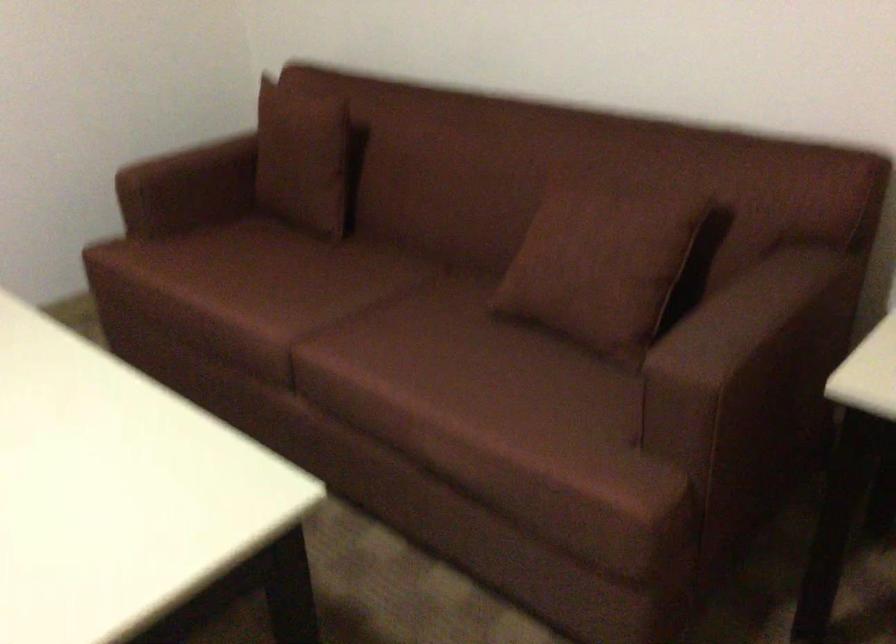
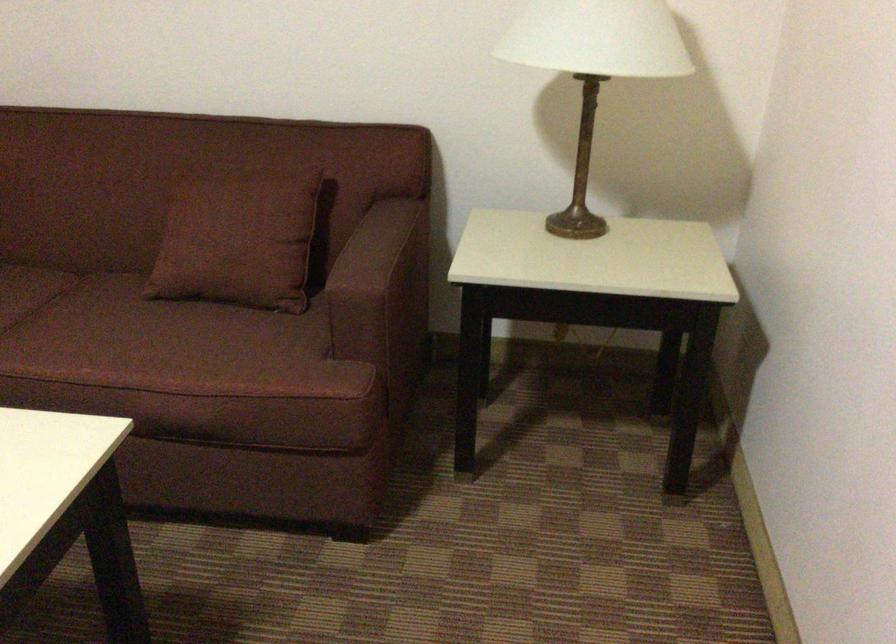
In the second image, find the point that corresponds to (x=448, y=361) in the first image.

(135, 339)